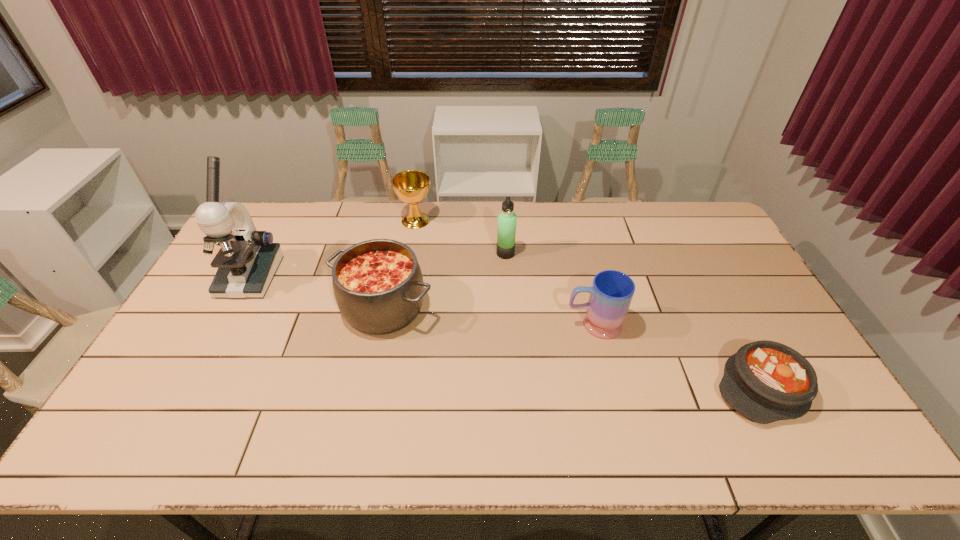
The image size is (960, 540). I want to click on vacant space that satisfies the following two spatial constraints: 1. on the front side of the leftmost object; 2. on the left side of the shorter casserole, so [190, 387].

Locate an element on the screen. The width and height of the screenshot is (960, 540). vacant space that satisfies the following two spatial constraints: 1. on the front side of the second tallest object; 2. on the left side of the nearer casserole is located at coordinates (514, 387).